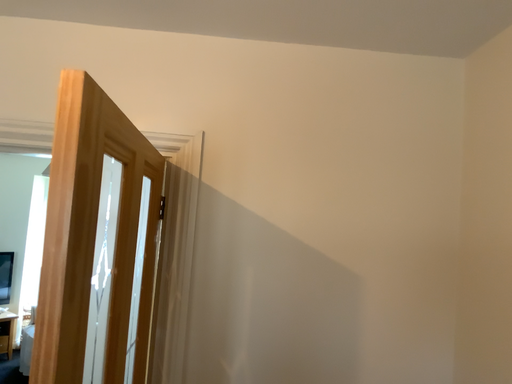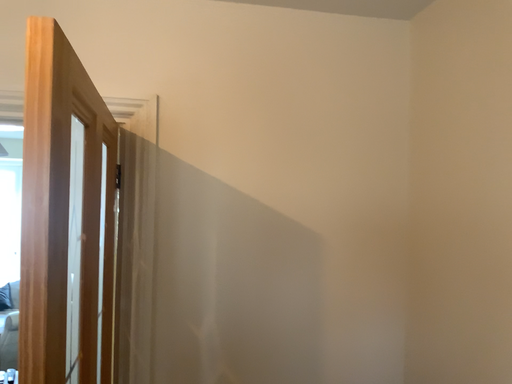
Question: How did the camera likely rotate when shooting the video?

Choices:
 (A) rotated left
 (B) rotated right

Answer: (B)